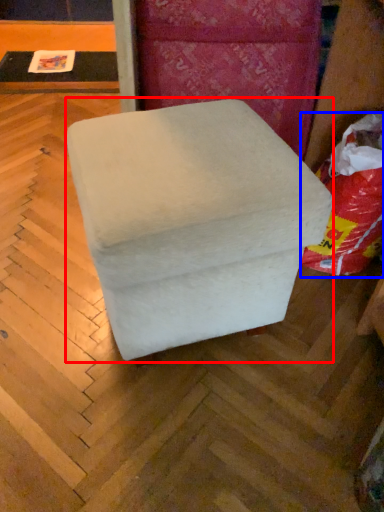
Question: Which object is further to the camera taking this photo, furniture (highlighted by a red box) or bean bag chair (highlighted by a blue box)?

Choices:
 (A) furniture
 (B) bean bag chair

Answer: (B)